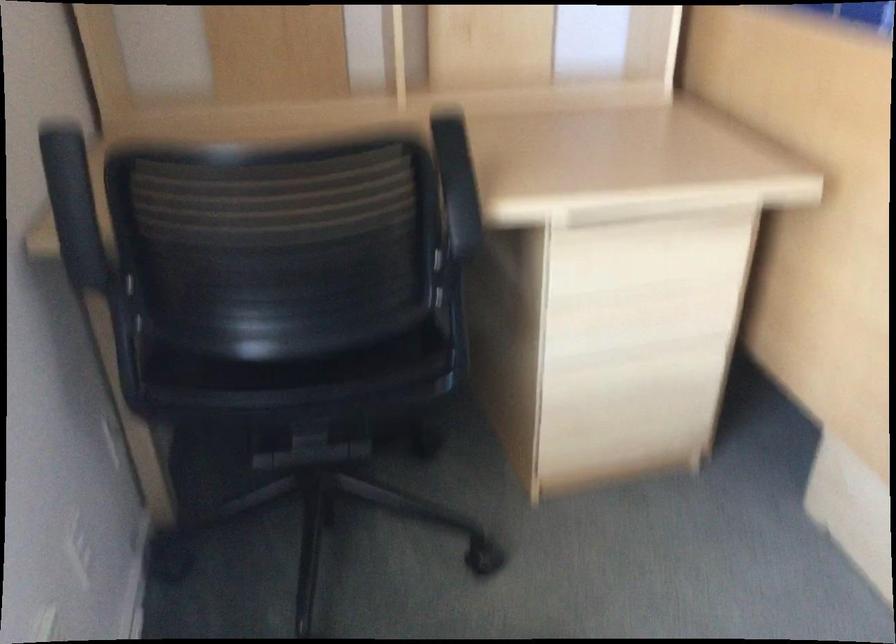
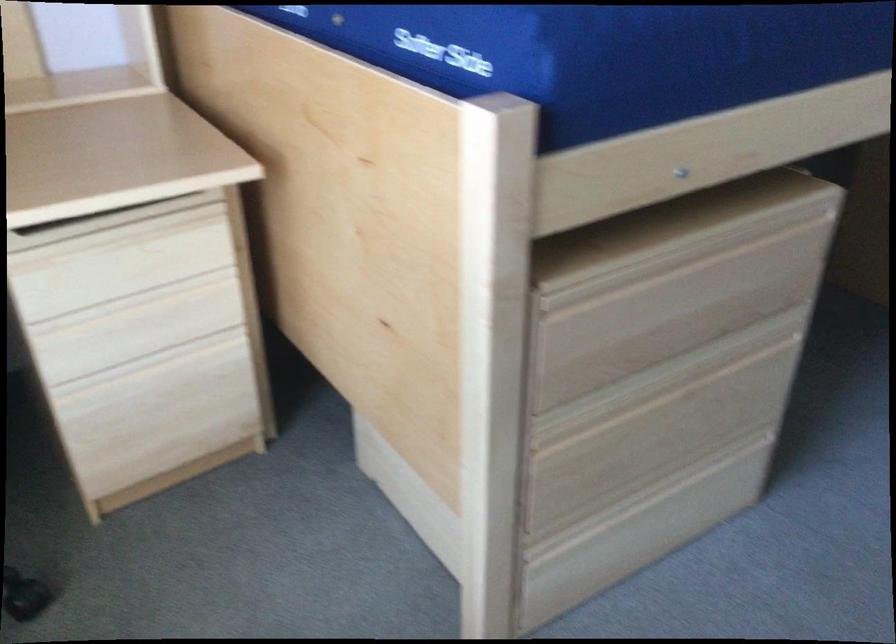
Find the pixel in the second image that matches point 634,362 in the first image.

(152, 361)